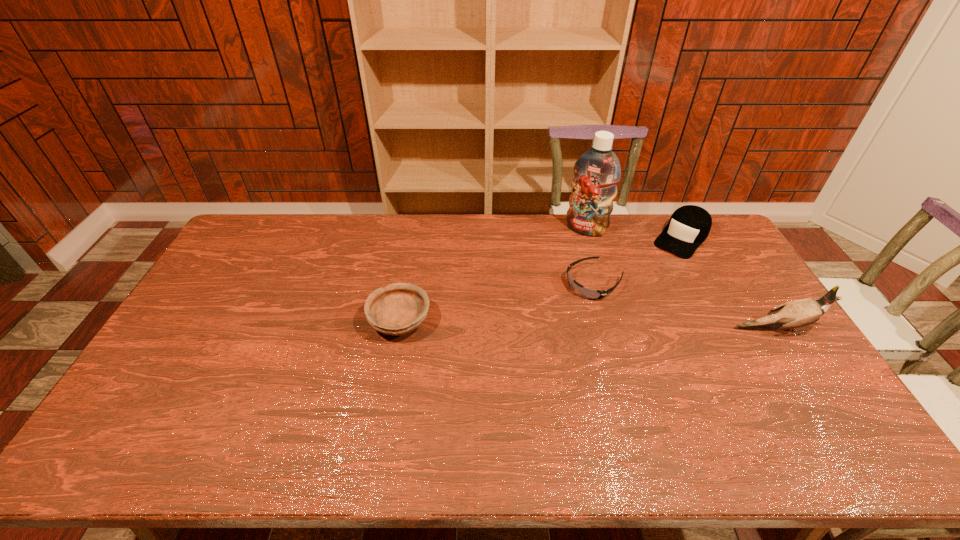
Where is `vacant space on the desktop that is between the bowl and the fourth shortest object and is positioned on the lenses of the shortest object`? vacant space on the desktop that is between the bowl and the fourth shortest object and is positioned on the lenses of the shortest object is located at coordinates (538, 324).

At what (x,y) coordinates should I click in order to perform the action: click on vacant space on the desktop that is between the second shortest object and the fourth shortest object and is positioned on the front label of the tallest object. Please return your answer as a coordinate pair (x, y). The width and height of the screenshot is (960, 540). Looking at the image, I should click on (532, 324).

Find the location of a particular element. The width and height of the screenshot is (960, 540). vacant space on the desktop that is between the second shortest object and the bird and is positioned on the front-facing side of the cap is located at coordinates (604, 326).